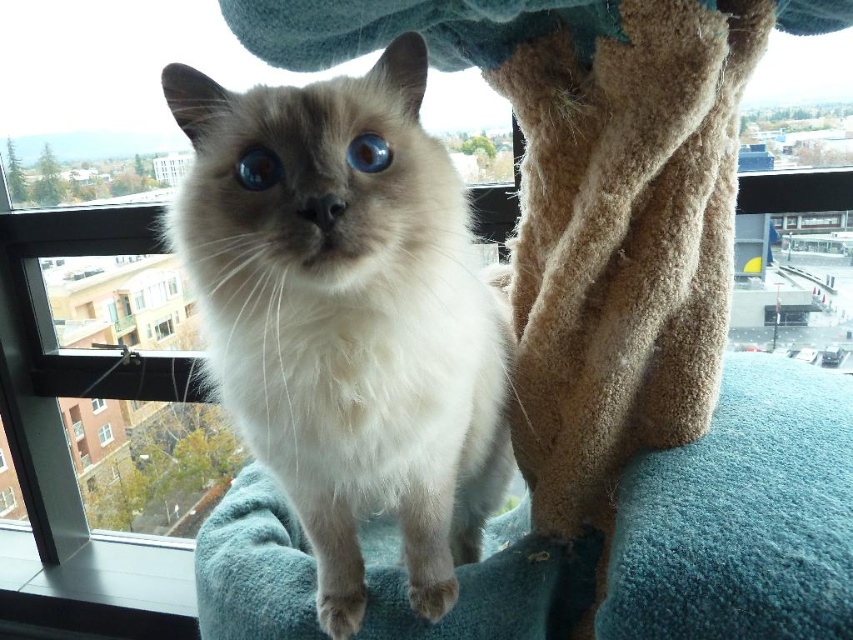
Question: Which point is farther to the camera?

Choices:
 (A) white fluffy cat at center
 (B) clear glass window at lower left
 (C) transparent plastic window at lower left
 (D) clear glass window at center

Answer: (B)

Question: Considering the relative positions of white fluffy cat at center and clear glass window at lower left in the image provided, where is white fluffy cat at center located with respect to clear glass window at lower left?

Choices:
 (A) below
 (B) above

Answer: (B)

Question: Can you confirm if white fluffy cat at center is wider than transparent glass window at center?

Choices:
 (A) yes
 (B) no

Answer: (A)

Question: Which object appears closest to the camera in this image?

Choices:
 (A) clear glass window at lower left
 (B) transparent plastic window at lower left
 (C) transparent glass window at center

Answer: (C)

Question: Is the position of white fluffy cat at center less distant than that of clear glass window at center?

Choices:
 (A) yes
 (B) no

Answer: (A)

Question: Which point is closer to the camera?

Choices:
 (A) transparent glass window at center
 (B) transparent glass window at lower left

Answer: (A)